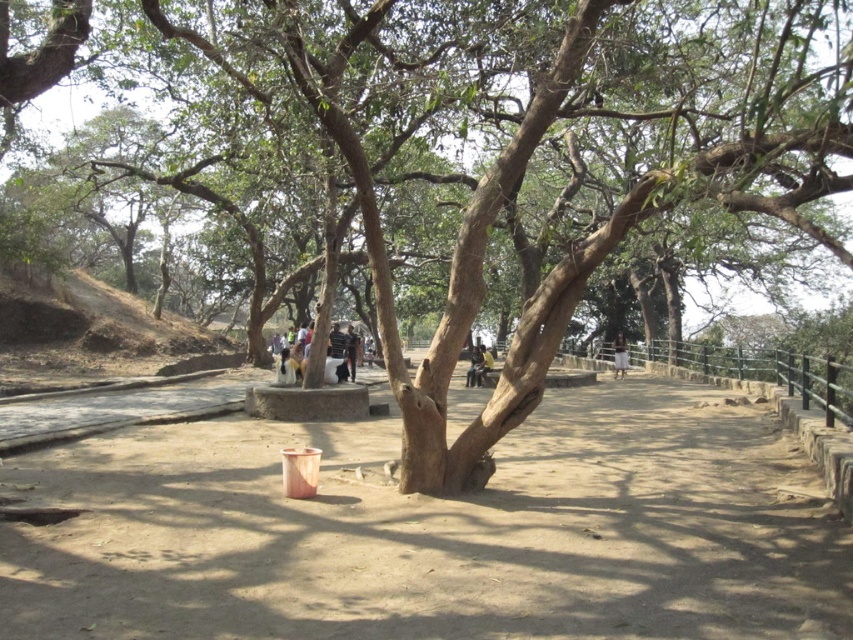
Question: Which is farther from the dark blue jeans at center?

Choices:
 (A) dark blue shirt at center
 (B) brown sandy dirt at center

Answer: (B)

Question: Among these objects, which one is farthest from the camera?

Choices:
 (A) brown sandy dirt at center
 (B) dark blue jeans at center
 (C) white cotton pants at center

Answer: (C)

Question: Which is nearer to the brown sandy dirt at center?

Choices:
 (A) dark blue shirt at center
 (B) dark blue jeans at center

Answer: (A)

Question: Can you confirm if brown sandy dirt at center is thinner than white cotton pants at center?

Choices:
 (A) yes
 (B) no

Answer: (B)

Question: Is brown sandy dirt at center thinner than dark blue jeans at center?

Choices:
 (A) yes
 (B) no

Answer: (B)

Question: Does dark blue shirt at center have a smaller size compared to dark blue jeans at center?

Choices:
 (A) yes
 (B) no

Answer: (B)